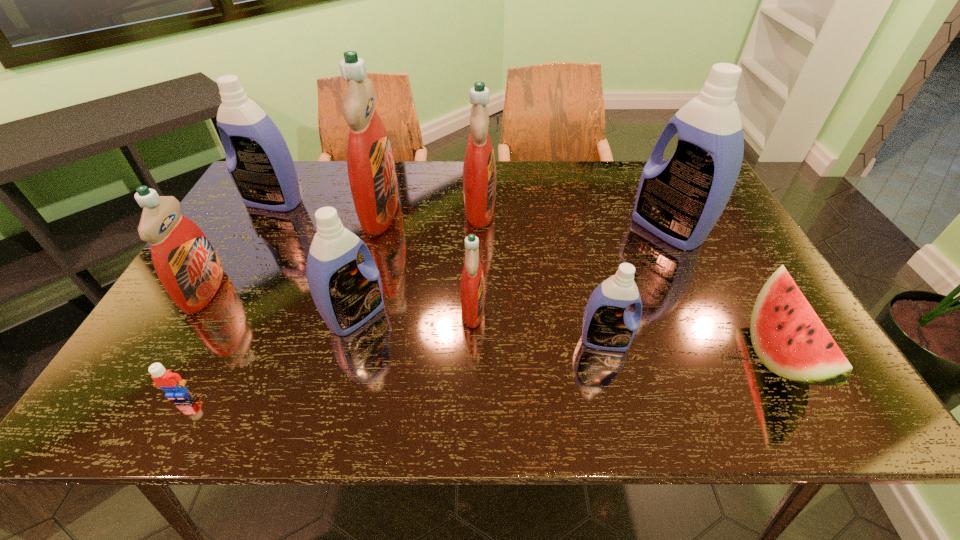
Locate an element on the screen. free region located 0.260m on the front surface of the smallest red detergent is located at coordinates (594, 309).

Where is `free point located on the back of the third blue detergent from left to right`? free point located on the back of the third blue detergent from left to right is located at coordinates (585, 258).

Locate an element on the screen. This screenshot has width=960, height=540. free location located 0.120m on the outer rind of the green watermelon is located at coordinates (695, 353).

Where is `vacant space located on the outer rind of the green watermelon`? The image size is (960, 540). vacant space located on the outer rind of the green watermelon is located at coordinates [718, 353].

Image resolution: width=960 pixels, height=540 pixels. In order to click on vacant space located on the outer rind of the green watermelon in this screenshot , I will do `click(636, 353)`.

This screenshot has height=540, width=960. I want to click on watermelon that is positioned at the near edge, so click(x=788, y=337).

You are a GUI agent. You are given a task and a screenshot of the screen. Output one action in this format:
    pyautogui.click(x=<x>, y=<y>)
    Task: Click on the Lego at the near edge
    This screenshot has height=540, width=960.
    Given the screenshot: What is the action you would take?
    [x=172, y=383]

Where is `Lego located at the left edge`? Lego located at the left edge is located at coordinates (172, 383).

This screenshot has width=960, height=540. I want to click on detergent at the right edge, so click(x=679, y=200).

Identify the location of watermelon present at the right edge. The image size is (960, 540). (788, 337).